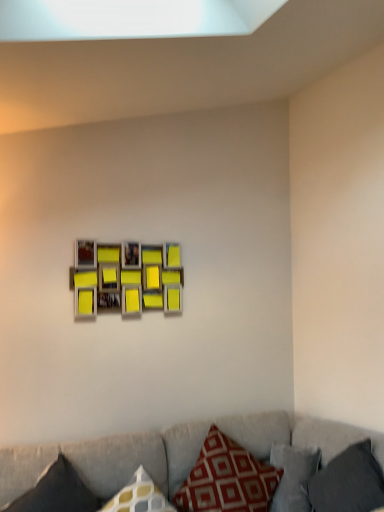
Question: In the image, is red printed cushion at lower center, the 2th pillow from the left, on the left side or the right side of dark gray fabric pillow at lower left, the 3th pillow positioned from the right?

Choices:
 (A) right
 (B) left

Answer: (A)

Question: Looking at the image, does red printed cushion at lower center, placed as the second pillow when sorted from right to left, seem bigger or smaller compared to dark gray fabric pillow at lower left, the 3th pillow positioned from the right?

Choices:
 (A) big
 (B) small

Answer: (A)

Question: Which of these objects is positioned farthest from the dark gray fabric pillow at lower left, the 3th pillow positioned from the right?

Choices:
 (A) matte yellow picture frame at center
 (B) red printed cushion at lower center, placed as the second pillow when sorted from right to left
 (C) dark gray fabric pillow at lower right, arranged as the third pillow when viewed from the left
 (D) textured gray couch at lower center

Answer: (C)

Question: Estimate the real-world distances between objects in this image. Which object is closer to the red printed cushion at lower center, the 2th pillow from the left?

Choices:
 (A) dark gray fabric pillow at lower left, the first pillow when ordered from left to right
 (B) matte yellow picture frame at center
 (C) dark gray fabric pillow at lower right, arranged as the third pillow when viewed from the left
 (D) textured gray couch at lower center

Answer: (D)